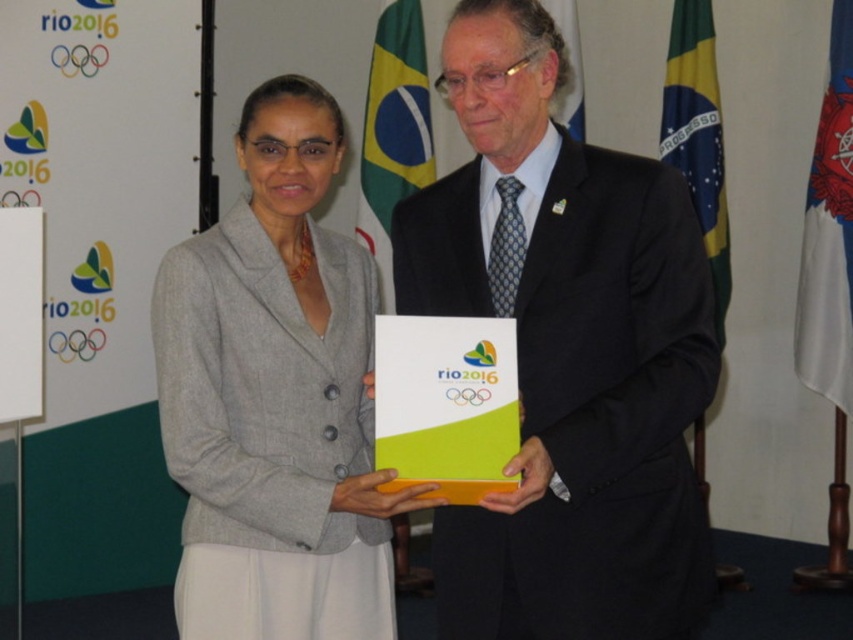
You are a photographer adjusting your camera settings to focus on the box held by the two people. The box has two points labeled as point (372,637) and point (851,360). Which point should you focus on to ensure it appears closer in the photo?

You should focus on point (372,637) because it is closer to the viewer than point (851,360).

You are a photographer who needs to capture a clear shot of both the gray woolen blazer at center and the blue fabric flag at right. Which object should you focus on first to ensure both are in focus?

You should focus on the gray woolen blazer at center first since it is closer to the viewer than the blue fabric flag at right. By focusing on the closer object, the flag will also be in focus due to the depth of field.

You are a photographer at the Rio 2016 Olympics. You need to ensure that both the black suit at center and the gray woolen blazer at center are clearly visible in your photo. Given their sizes, which one might you need to position closer to the camera to ensure it doesn

The black suit at center is smaller than the gray woolen blazer at center. To ensure both are clearly visible, you should position the black suit at center closer to the camera so it appears larger in the frame.